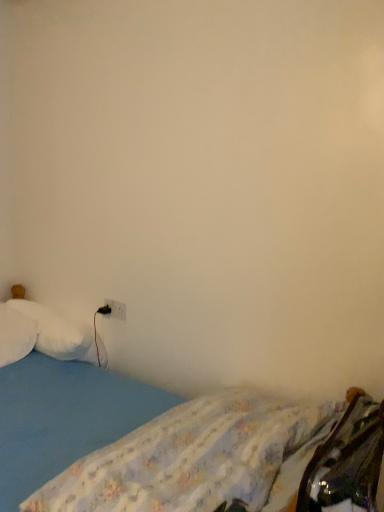
I want to click on blue fabric bed at lower left, so point(198,459).

Measure the distance between white plastic electric outlet at lower left and camera.

white plastic electric outlet at lower left and camera are 2.15 meters apart.

This screenshot has height=512, width=384. What are the coordinates of `blue fabric mattress at lower left` in the screenshot? It's located at (197, 459).

From a real-world perspective, is blue fabric mattress at lower left physically located above or below white fluffy pillow at left, which is counted as the 2th pillow, starting from the right?

In terms of real-world spatial position, blue fabric mattress at lower left is above white fluffy pillow at left, which is counted as the 2th pillow, starting from the right.

From the image's perspective, is blue fabric mattress at lower left above or below white fluffy pillow at left, which ranks as the 1th pillow in left-to-right order?

Based on their image positions, blue fabric mattress at lower left is located beneath white fluffy pillow at left, which ranks as the 1th pillow in left-to-right order.

Which of these two, blue fabric mattress at lower left or white soft pillow at left, placed as the 2th pillow when sorted from left to right, is smaller?

white soft pillow at left, placed as the 2th pillow when sorted from left to right.

Is blue fabric mattress at lower left positioned with its back to white soft pillow at left, placed as the first pillow when sorted from right to left?

No, blue fabric mattress at lower left is not facing away from white soft pillow at left, placed as the first pillow when sorted from right to left.

Consider the image. Would you say blue fabric mattress at lower left is to the left or to the right of white soft pillow at left, placed as the 2th pillow when sorted from left to right, in the picture?

In the image, blue fabric mattress at lower left appears on the right side of white soft pillow at left, placed as the 2th pillow when sorted from left to right.

From the picture: Considering the relative sizes of blue fabric mattress at lower left and white soft pillow at left, placed as the 2th pillow when sorted from left to right, in the image provided, is blue fabric mattress at lower left shorter than white soft pillow at left, placed as the 2th pillow when sorted from left to right,?

No, blue fabric mattress at lower left is not shorter than white soft pillow at left, placed as the 2th pillow when sorted from left to right.

Based on the photo, which point is more forward, (x=205, y=415) or (x=278, y=459)?

The point (x=278, y=459) is closer.

Does blue fabric bed at lower left have a lesser height compared to blue fabric mattress at lower left?

No.

From the image's perspective, which one is positioned higher, blue fabric bed at lower left or blue fabric mattress at lower left?

From the image's view, blue fabric mattress at lower left is above.

Does blue fabric bed at lower left have a greater width compared to blue fabric mattress at lower left?

Correct, the width of blue fabric bed at lower left exceeds that of blue fabric mattress at lower left.

From the picture: Who is smaller, white soft pillow at left, placed as the 2th pillow when sorted from left to right, or blue fabric mattress at lower left?

With smaller size is white soft pillow at left, placed as the 2th pillow when sorted from left to right.

Is white soft pillow at left, placed as the first pillow when sorted from right to left, spatially inside blue fabric mattress at lower left, or outside of it?

white soft pillow at left, placed as the first pillow when sorted from right to left, exists outside the volume of blue fabric mattress at lower left.

Is white soft pillow at left, placed as the first pillow when sorted from right to left, far away from blue fabric mattress at lower left?

Absolutely, white soft pillow at left, placed as the first pillow when sorted from right to left, is distant from blue fabric mattress at lower left.

Is blue fabric bed at lower left positioned far away from white soft pillow at left, placed as the 2th pillow when sorted from left to right?

No, blue fabric bed at lower left is not far from white soft pillow at left, placed as the 2th pillow when sorted from left to right.

Considering the sizes of blue fabric bed at lower left and white soft pillow at left, placed as the first pillow when sorted from right to left, in the image, is blue fabric bed at lower left wider or thinner than white soft pillow at left, placed as the first pillow when sorted from right to left,?

Clearly, blue fabric bed at lower left has more width compared to white soft pillow at left, placed as the first pillow when sorted from right to left.

Is blue fabric bed at lower left positioned with its back to white soft pillow at left, placed as the first pillow when sorted from right to left?

That's not correct — blue fabric bed at lower left is not looking away from white soft pillow at left, placed as the first pillow when sorted from right to left.

Is white soft pillow at left, placed as the first pillow when sorted from right to left, taller than white plastic electric outlet at lower left?

Correct, white soft pillow at left, placed as the first pillow when sorted from right to left, is much taller as white plastic electric outlet at lower left.

Is white soft pillow at left, placed as the 2th pillow when sorted from left to right, in front of white plastic electric outlet at lower left?

Yes, white soft pillow at left, placed as the 2th pillow when sorted from left to right, is in front of white plastic electric outlet at lower left.

Considering the relative sizes of white soft pillow at left, placed as the first pillow when sorted from right to left, and white plastic electric outlet at lower left in the image provided, is white soft pillow at left, placed as the first pillow when sorted from right to left, bigger than white plastic electric outlet at lower left?

Yes, white soft pillow at left, placed as the first pillow when sorted from right to left, is bigger than white plastic electric outlet at lower left.

Is white soft pillow at left, placed as the first pillow when sorted from right to left, far from white plastic electric outlet at lower left?

No, white soft pillow at left, placed as the first pillow when sorted from right to left, is in close proximity to white plastic electric outlet at lower left.

Considering the sizes of objects white fluffy pillow at left, which ranks as the 1th pillow in left-to-right order, and blue fabric mattress at lower left in the image provided, who is shorter, white fluffy pillow at left, which ranks as the 1th pillow in left-to-right order, or blue fabric mattress at lower left?

white fluffy pillow at left, which ranks as the 1th pillow in left-to-right order, is shorter.

Is white fluffy pillow at left, which is counted as the 2th pillow, starting from the right, to the left or to the right of blue fabric mattress at lower left in the image?

white fluffy pillow at left, which is counted as the 2th pillow, starting from the right, is positioned on blue fabric mattress at lower left's left side.

The image size is (384, 512). I want to click on mattress in front of the white fluffy pillow at left, which is counted as the 2th pillow, starting from the right, so click(197, 459).

Is blue fabric mattress at lower left at the back of white fluffy pillow at left, which is counted as the 2th pillow, starting from the right?

No.

Where is `mattress above the white fluffy pillow at left, which is counted as the 2th pillow, starting from the right (from a real-world perspective)`? mattress above the white fluffy pillow at left, which is counted as the 2th pillow, starting from the right (from a real-world perspective) is located at coordinates (197, 459).

Identify the location of the 1st pillow to the left of the blue fabric mattress at lower left, counting from the anchor's position. (57, 333).

Estimate the real-world distances between objects in this image. Which object is further from blue fabric bed at lower left, white fluffy pillow at left, which is counted as the 2th pillow, starting from the right, or white soft pillow at left, placed as the 2th pillow when sorted from left to right?

The object further to blue fabric bed at lower left is white fluffy pillow at left, which is counted as the 2th pillow, starting from the right.

Considering their positions, is white soft pillow at left, placed as the 2th pillow when sorted from left to right, positioned closer to white fluffy pillow at left, which ranks as the 1th pillow in left-to-right order, than blue fabric bed at lower left?

white soft pillow at left, placed as the 2th pillow when sorted from left to right, is positioned closer to the anchor white fluffy pillow at left, which ranks as the 1th pillow in left-to-right order.

Looking at the image, which one is located further to white soft pillow at left, placed as the 2th pillow when sorted from left to right, white plastic electric outlet at lower left or blue fabric mattress at lower left?

blue fabric mattress at lower left is positioned further to the anchor white soft pillow at left, placed as the 2th pillow when sorted from left to right.

When comparing their distances from white fluffy pillow at left, which ranks as the 1th pillow in left-to-right order, does blue fabric mattress at lower left or blue fabric bed at lower left seem closer?

Based on the image, blue fabric bed at lower left appears to be nearer to white fluffy pillow at left, which ranks as the 1th pillow in left-to-right order.

Based on their spatial positions, is white soft pillow at left, placed as the 2th pillow when sorted from left to right, or blue fabric mattress at lower left further from white plastic electric outlet at lower left?

Based on the image, blue fabric mattress at lower left appears to be further to white plastic electric outlet at lower left.

From the image, which object appears to be nearer to white fluffy pillow at left, which ranks as the 1th pillow in left-to-right order, white plastic electric outlet at lower left or blue fabric bed at lower left?

Based on the image, white plastic electric outlet at lower left appears to be nearer to white fluffy pillow at left, which ranks as the 1th pillow in left-to-right order.

From the image, which object appears to be nearer to white soft pillow at left, placed as the first pillow when sorted from right to left, white fluffy pillow at left, which ranks as the 1th pillow in left-to-right order, or white plastic electric outlet at lower left?

white fluffy pillow at left, which ranks as the 1th pillow in left-to-right order.

When comparing their distances from white plastic electric outlet at lower left, does white fluffy pillow at left, which ranks as the 1th pillow in left-to-right order, or blue fabric bed at lower left seem closer?

white fluffy pillow at left, which ranks as the 1th pillow in left-to-right order, lies closer to white plastic electric outlet at lower left than the other object.

You are a GUI agent. You are given a task and a screenshot of the screen. Output one action in this format:
    pyautogui.click(x=<x>, y=<y>)
    Task: Click on the pillow located between blue fabric mattress at lower left and white soft pillow at left, placed as the 2th pillow when sorted from left to right, in the depth direction
    Image resolution: width=384 pixels, height=512 pixels.
    Given the screenshot: What is the action you would take?
    pyautogui.click(x=15, y=335)

Where is `mattress positioned between blue fabric bed at lower left and white fluffy pillow at left, which ranks as the 1th pillow in left-to-right order, from near to far`? The height and width of the screenshot is (512, 384). mattress positioned between blue fabric bed at lower left and white fluffy pillow at left, which ranks as the 1th pillow in left-to-right order, from near to far is located at coordinates (197, 459).

You are a GUI agent. You are given a task and a screenshot of the screen. Output one action in this format:
    pyautogui.click(x=<x>, y=<y>)
    Task: Click on the mattress between blue fabric bed at lower left and white soft pillow at left, placed as the first pillow when sorted from right to left, along the z-axis
    The height and width of the screenshot is (512, 384).
    Given the screenshot: What is the action you would take?
    pyautogui.click(x=197, y=459)

This screenshot has height=512, width=384. I want to click on pillow located between white fluffy pillow at left, which ranks as the 1th pillow in left-to-right order, and white plastic electric outlet at lower left in the left-right direction, so click(x=57, y=333).